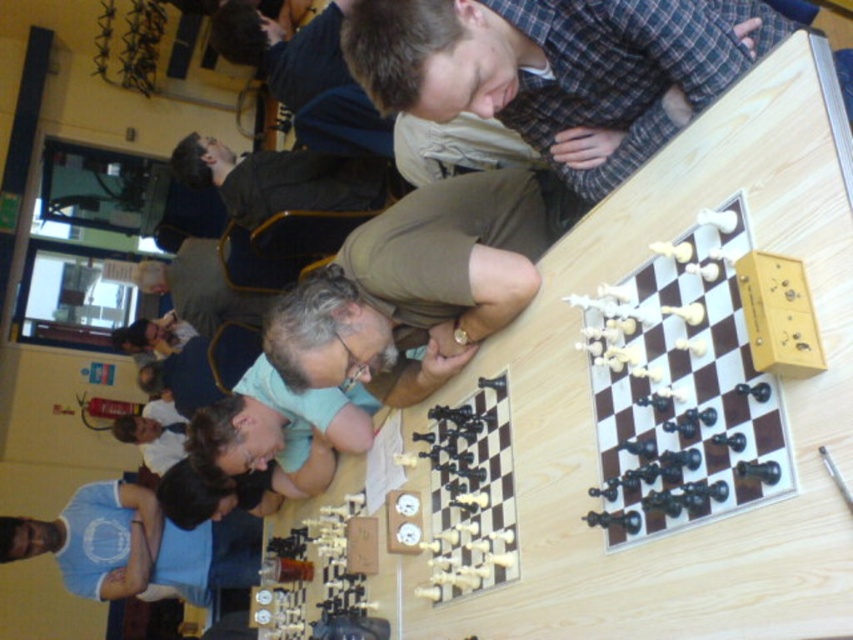
You are a chess player who wants to place the black plastic chess pieces at center onto the wooden chessboard at upper right. Based on the size, will the pieces fit comfortably on the board?

The wooden chessboard at upper right has a larger size compared to the black plastic chess pieces at center, so the pieces will fit comfortably on the board.

You are a photographer trying to capture a closeup of the wooden chessboard at upper right and the blue cotton shirt at lower left. Since you want both objects to appear similarly sized in the photo, which object should you move closer to the camera?

The wooden chessboard at upper right is smaller in size compared to the blue cotton shirt at lower left. To make them appear similarly sized in the photo, you should move the wooden chessboard at upper right closer to the camera.